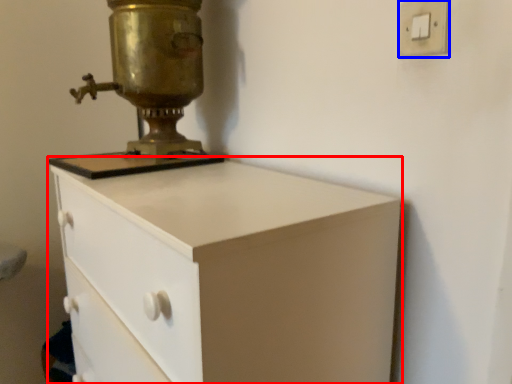
Question: Which object appears closest to the camera in this image, chest of drawers (highlighted by a red box) or light switch (highlighted by a blue box)?

Choices:
 (A) chest of drawers
 (B) light switch

Answer: (A)